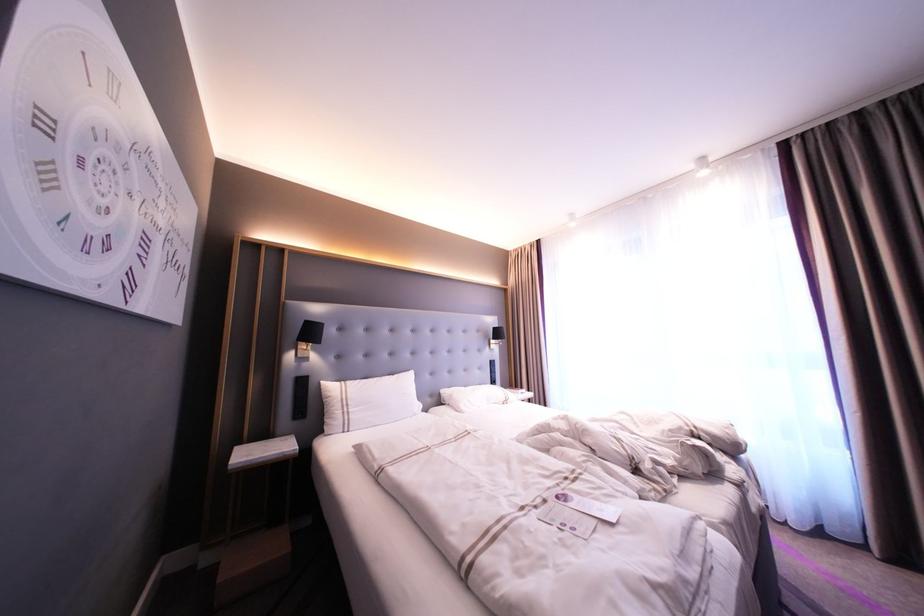
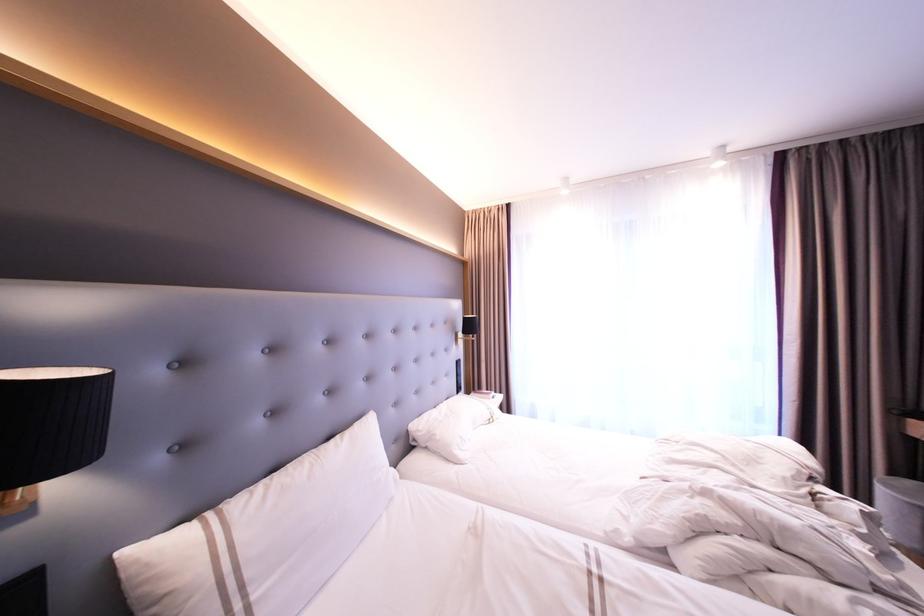
Where in the second image is the point corresponding to the point at 407,379 from the first image?

(365, 435)